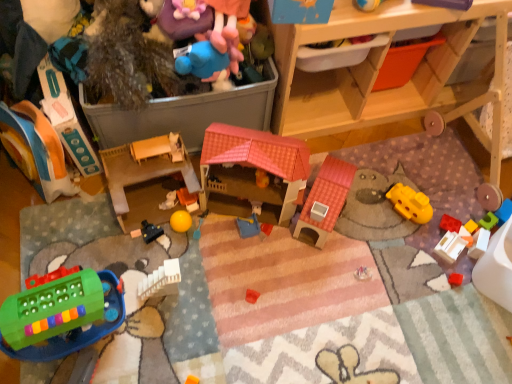
Find the location of `vacant space that is in between white matte block at lower right, which is the 12th toy in left-to-right order, and smooth plastic toy at center, the ninth toy viewed from the right`. vacant space that is in between white matte block at lower right, which is the 12th toy in left-to-right order, and smooth plastic toy at center, the ninth toy viewed from the right is located at coordinates (339, 231).